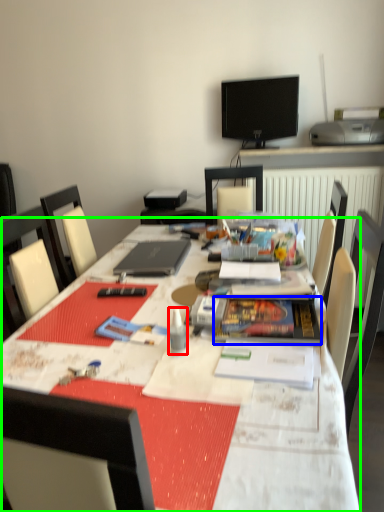
Question: Based on their relative distances, which object is farther from stationery (highlighted by a red box)? Choose from paperback book (highlighted by a blue box) and table (highlighted by a green box).

Choices:
 (A) paperback book
 (B) table

Answer: (B)